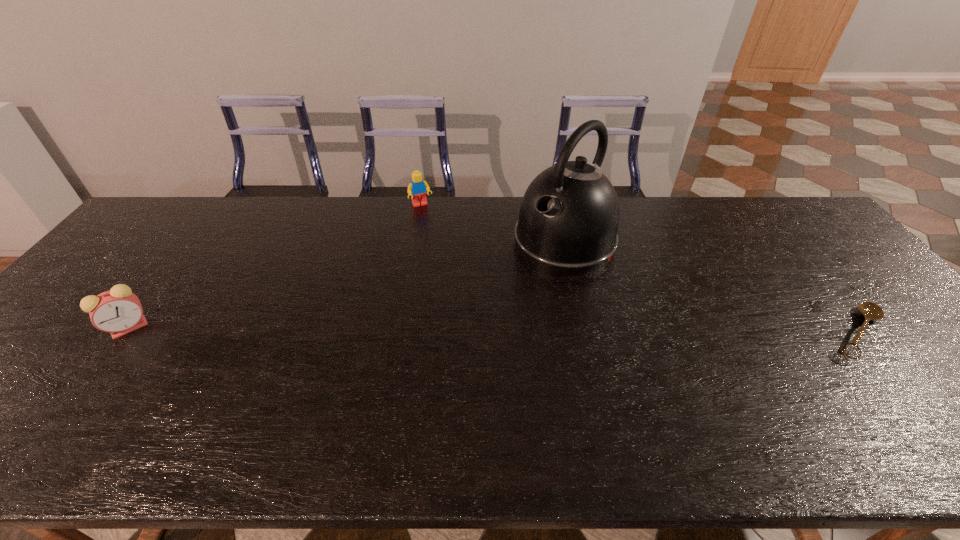
Find the location of a particular element. This screenshot has width=960, height=540. vacant space situated 0.290m on the spout of the second object from right to left is located at coordinates (473, 327).

At what (x,y) coordinates should I click in order to perform the action: click on free location located on the spout of the second object from right to left. Please return your answer as a coordinate pair (x, y). The height and width of the screenshot is (540, 960). Looking at the image, I should click on (450, 348).

This screenshot has width=960, height=540. I want to click on free location located 0.340m on the front-facing side of the farthest object, so click(x=457, y=273).

Locate an element on the screen. vacant region located 0.100m on the front-facing side of the farthest object is located at coordinates (433, 226).

This screenshot has width=960, height=540. What are the coordinates of `vacant space located on the front-facing side of the farthest object` in the screenshot? It's located at (441, 240).

In order to click on kettle present at the far edge in this screenshot , I will do `click(568, 221)`.

The height and width of the screenshot is (540, 960). I want to click on Lego that is positioned at the far edge, so click(417, 188).

This screenshot has width=960, height=540. Identify the location of object positioned at the left edge. (118, 311).

Locate an element on the screen. object that is at the right edge is located at coordinates (871, 311).

Image resolution: width=960 pixels, height=540 pixels. Identify the location of vacant space at the far edge of the desktop. (734, 207).